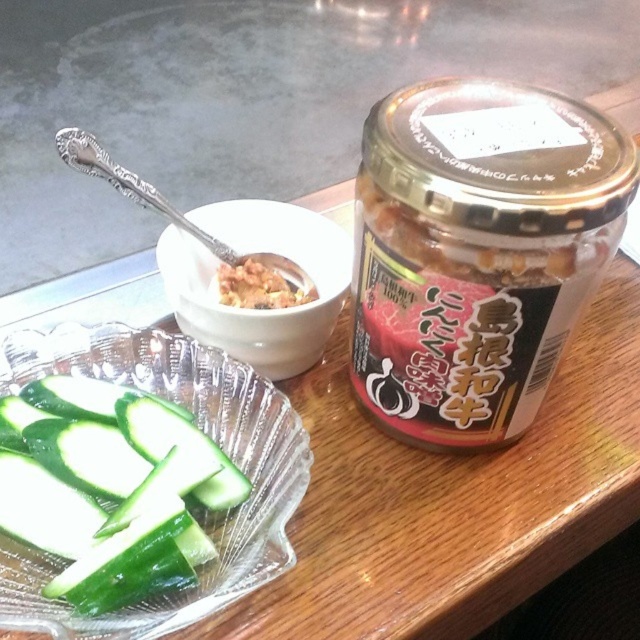
You are setting up a table for a Japanese meal and have the transparent glass jar at right and the white ceramic bowl at center. Which item is located to the left of the other?

The white ceramic bowl at center is to the left of the transparent glass jar at right because the jar is positioned on the right side of the bowl.

You are setting up a table for a Japanese meal and want to arrange the green smooth cucumber at lower left and the white ceramic bowl at center. Which object should you place first if you want the wider item to be on the left side of the narrower one?

The green smooth cucumber at lower left is wider than the white ceramic bowl at center, so you should place the green smooth cucumber at lower left first on the left side followed by the white ceramic bowl at center on the right side.